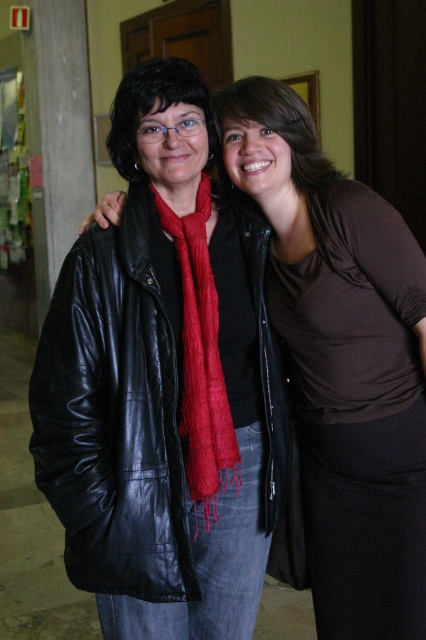
You are standing in the hallway shown in the image. There is a matte black leather jacket at left located at point (342, 362). You need to place a small potted plant exactly at the same coordinates. Will the plant fit in the space where the matte black leather jacket at left is currently located?

The matte black leather jacket at left is located at point (342, 362). Since the jacket is an object occupying that space, placing a potted plant there would require moving the jacket first. The space may be suitable for the plant, but it currently has the jacket in that location.

You are a fashion designer observing two black items in the scene. The matte black leather jacket at left and the matte black scarf at upper left. Which item is positioned to the right of the other?

The matte black leather jacket at left is positioned on the right side of the matte black scarf at upper left, so the jacket is to the right of the scarf.

You are standing in the hallway and want to touch the point at coordinate (342, 362). Which person should you approach to reach that point?

The point at coordinate (342, 362) is located on the matte black leather jacket at left, so you should approach the person on the left side.